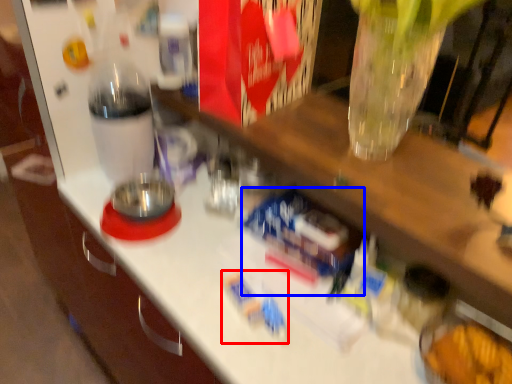
Question: Which object appears farthest to the camera in this image, toy (highlighted by a red box) or toy (highlighted by a blue box)?

Choices:
 (A) toy
 (B) toy

Answer: (B)